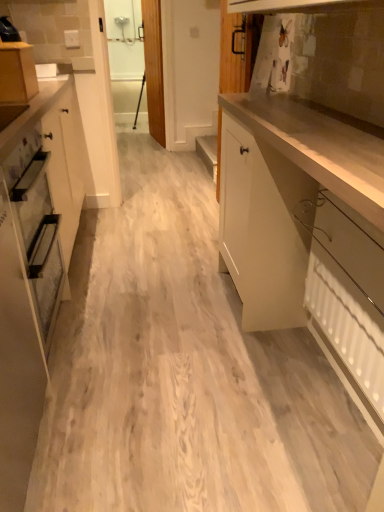
Image resolution: width=384 pixels, height=512 pixels. What do you see at coordinates (30, 277) in the screenshot? I see `white glossy cabinet at left, the 2th cabinetry positioned from the right` at bounding box center [30, 277].

Find the location of a particular element. This screenshot has width=384, height=512. glossy white cabinet at right, the 3th cabinetry positioned from the left is located at coordinates (308, 233).

I want to click on matte wood cabinet at upper left, which is counted as the third cabinetry, starting from the right, so click(17, 73).

In terms of height, does white textured radiator at lower right look taller or shorter compared to glossy white cabinet at right, the 3th cabinetry positioned from the left?

In the image, white textured radiator at lower right appears to be shorter than glossy white cabinet at right, the 3th cabinetry positioned from the left.

Is point (316, 289) closer to camera compared to point (315, 256)?

No, (316, 289) is further to viewer.

Looking at the image, does white textured radiator at lower right seem bigger or smaller compared to glossy white cabinet at right, which appears as the first cabinetry when viewed from the right?

Considering their sizes, white textured radiator at lower right takes up less space than glossy white cabinet at right, which appears as the first cabinetry when viewed from the right.

Is white textured radiator at lower right facing towards glossy white cabinet at right, the 3th cabinetry positioned from the left?

Yes, white textured radiator at lower right is aimed at glossy white cabinet at right, the 3th cabinetry positioned from the left.

Who is smaller, white glossy cabinet at left, the 2th cabinetry when ordered from left to right, or white textured radiator at lower right?

Smaller between the two is white textured radiator at lower right.

Could you tell me if white glossy cabinet at left, the 2th cabinetry positioned from the right, is turned towards white textured radiator at lower right?

Yes, white glossy cabinet at left, the 2th cabinetry positioned from the right, is turned towards white textured radiator at lower right.

Is point (27, 321) closer or farther from the camera than point (336, 279)?

Point (27, 321) appears to be farther away from the viewer than point (336, 279).

Which of these two, white glossy cabinet at left, the 2th cabinetry when ordered from left to right, or white textured radiator at lower right, stands shorter?

white textured radiator at lower right is shorter.

Is white glossy cabinet at left, the 2th cabinetry when ordered from left to right, facing away from glossy white cabinet at right, the 3th cabinetry positioned from the left?

white glossy cabinet at left, the 2th cabinetry when ordered from left to right, does not have its back to glossy white cabinet at right, the 3th cabinetry positioned from the left.

Which object is positioned more to the right, white glossy cabinet at left, the 2th cabinetry positioned from the right, or glossy white cabinet at right, which appears as the first cabinetry when viewed from the right?

Positioned to the right is glossy white cabinet at right, which appears as the first cabinetry when viewed from the right.

From a real-world perspective, is white glossy cabinet at left, the 2th cabinetry positioned from the right, on glossy white cabinet at right, the 3th cabinetry positioned from the left?

Yes.

Considering the relative sizes of white glossy cabinet at left, the 2th cabinetry positioned from the right, and matte wood cabinet at upper left, which appears as the first cabinetry when viewed from the left, in the image provided, is white glossy cabinet at left, the 2th cabinetry positioned from the right, thinner than matte wood cabinet at upper left, which appears as the first cabinetry when viewed from the left,?

No, white glossy cabinet at left, the 2th cabinetry positioned from the right, is not thinner than matte wood cabinet at upper left, which appears as the first cabinetry when viewed from the left.

Is white glossy cabinet at left, the 2th cabinetry when ordered from left to right, completely or partially outside of matte wood cabinet at upper left, which appears as the first cabinetry when viewed from the left?

Indeed, white glossy cabinet at left, the 2th cabinetry when ordered from left to right, is completely outside matte wood cabinet at upper left, which appears as the first cabinetry when viewed from the left.

Which of these two, white glossy cabinet at left, the 2th cabinetry when ordered from left to right, or matte wood cabinet at upper left, which appears as the first cabinetry when viewed from the left, stands taller?

With more height is white glossy cabinet at left, the 2th cabinetry when ordered from left to right.

Can you tell me how much white textured radiator at lower right and matte wood cabinet at upper left, which is counted as the third cabinetry, starting from the right, differ in facing direction?

The angular difference between white textured radiator at lower right and matte wood cabinet at upper left, which is counted as the third cabinetry, starting from the right, is 180 degrees.

Is white textured radiator at lower right far from matte wood cabinet at upper left, which appears as the first cabinetry when viewed from the left?

Indeed, white textured radiator at lower right is not near matte wood cabinet at upper left, which appears as the first cabinetry when viewed from the left.

From their relative heights in the image, would you say white textured radiator at lower right is taller or shorter than matte wood cabinet at upper left, which is counted as the third cabinetry, starting from the right?

Considering their sizes, white textured radiator at lower right has more height than matte wood cabinet at upper left, which is counted as the third cabinetry, starting from the right.

Is point (377, 407) closer or farther from the camera than point (21, 75)?

Point (377, 407) is positioned closer to the camera compared to point (21, 75).

Consider the image. How different are the orientations of matte wood cabinet at upper left, which is counted as the third cabinetry, starting from the right, and white textured radiator at lower right in degrees?

The angle between the facing direction of matte wood cabinet at upper left, which is counted as the third cabinetry, starting from the right, and the facing direction of white textured radiator at lower right is 180 degrees.

Are matte wood cabinet at upper left, which is counted as the third cabinetry, starting from the right, and white textured radiator at lower right beside each other?

No, matte wood cabinet at upper left, which is counted as the third cabinetry, starting from the right, is not beside white textured radiator at lower right.

From a real-world perspective, who is located lower, matte wood cabinet at upper left, which is counted as the third cabinetry, starting from the right, or white textured radiator at lower right?

white textured radiator at lower right, from a real-world perspective.

Which is correct: matte wood cabinet at upper left, which is counted as the third cabinetry, starting from the right, is inside white textured radiator at lower right, or outside of it?

matte wood cabinet at upper left, which is counted as the third cabinetry, starting from the right, is not enclosed by white textured radiator at lower right.

Which point is more forward, [11,42] or [28,222]?

The point [28,222] is in front.

Locate an element on the screen. This screenshot has height=512, width=384. cabinetry that appears on the left of white glossy cabinet at left, the 2th cabinetry positioned from the right is located at coordinates pos(17,73).

From the image's perspective, is matte wood cabinet at upper left, which appears as the first cabinetry when viewed from the left, on top of white glossy cabinet at left, the 2th cabinetry positioned from the right?

Correct, matte wood cabinet at upper left, which appears as the first cabinetry when viewed from the left, appears higher than white glossy cabinet at left, the 2th cabinetry positioned from the right, in the image.

Is matte wood cabinet at upper left, which is counted as the third cabinetry, starting from the right, oriented towards white glossy cabinet at left, the 2th cabinetry positioned from the right?

No.

The height and width of the screenshot is (512, 384). What are the coordinates of `the 1st cabinetry above the white textured radiator at lower right (from a real-world perspective)` in the screenshot? It's located at (308, 233).

Identify the location of the 2nd cabinetry to the left of the white textured radiator at lower right, counting from the anchor's position. (30, 277).

Looking at the image, which one is located further to white textured radiator at lower right, white glossy cabinet at left, the 2th cabinetry when ordered from left to right, or matte wood cabinet at upper left, which is counted as the third cabinetry, starting from the right?

matte wood cabinet at upper left, which is counted as the third cabinetry, starting from the right, is positioned further to the anchor white textured radiator at lower right.

From the image, which object appears to be farther from white textured radiator at lower right, matte wood cabinet at upper left, which appears as the first cabinetry when viewed from the left, or white glossy cabinet at left, the 2th cabinetry positioned from the right?

matte wood cabinet at upper left, which appears as the first cabinetry when viewed from the left.

Looking at the image, which one is located closer to matte wood cabinet at upper left, which is counted as the third cabinetry, starting from the right, white textured radiator at lower right or white glossy cabinet at left, the 2th cabinetry when ordered from left to right?

white glossy cabinet at left, the 2th cabinetry when ordered from left to right.

Looking at the image, which one is located further to matte wood cabinet at upper left, which appears as the first cabinetry when viewed from the left, glossy white cabinet at right, which appears as the first cabinetry when viewed from the right, or white glossy cabinet at left, the 2th cabinetry when ordered from left to right?

glossy white cabinet at right, which appears as the first cabinetry when viewed from the right, lies further to matte wood cabinet at upper left, which appears as the first cabinetry when viewed from the left, than the other object.

Looking at this image, considering their positions, is white textured radiator at lower right positioned closer to glossy white cabinet at right, the 3th cabinetry positioned from the left, than matte wood cabinet at upper left, which is counted as the third cabinetry, starting from the right?

Based on the image, white textured radiator at lower right appears to be nearer to glossy white cabinet at right, the 3th cabinetry positioned from the left.

Which object lies nearer to the anchor point white glossy cabinet at left, the 2th cabinetry positioned from the right, glossy white cabinet at right, which appears as the first cabinetry when viewed from the right, or white textured radiator at lower right?

The object closer to white glossy cabinet at left, the 2th cabinetry positioned from the right, is glossy white cabinet at right, which appears as the first cabinetry when viewed from the right.

Looking at the image, which one is located closer to matte wood cabinet at upper left, which is counted as the third cabinetry, starting from the right, white glossy cabinet at left, the 2th cabinetry positioned from the right, or white textured radiator at lower right?

The object closer to matte wood cabinet at upper left, which is counted as the third cabinetry, starting from the right, is white glossy cabinet at left, the 2th cabinetry positioned from the right.

Considering their positions, is glossy white cabinet at right, the 3th cabinetry positioned from the left, positioned further to white glossy cabinet at left, the 2th cabinetry when ordered from left to right, than matte wood cabinet at upper left, which appears as the first cabinetry when viewed from the left?

The object further to white glossy cabinet at left, the 2th cabinetry when ordered from left to right, is glossy white cabinet at right, the 3th cabinetry positioned from the left.

Where is `cabinetry positioned between glossy white cabinet at right, the 3th cabinetry positioned from the left, and matte wood cabinet at upper left, which appears as the first cabinetry when viewed from the left, from near to far`? The width and height of the screenshot is (384, 512). cabinetry positioned between glossy white cabinet at right, the 3th cabinetry positioned from the left, and matte wood cabinet at upper left, which appears as the first cabinetry when viewed from the left, from near to far is located at coordinates pyautogui.click(x=30, y=277).

Find the location of `cabinetry between white glossy cabinet at left, the 2th cabinetry positioned from the right, and white textured radiator at lower right from left to right`. cabinetry between white glossy cabinet at left, the 2th cabinetry positioned from the right, and white textured radiator at lower right from left to right is located at coordinates (308, 233).